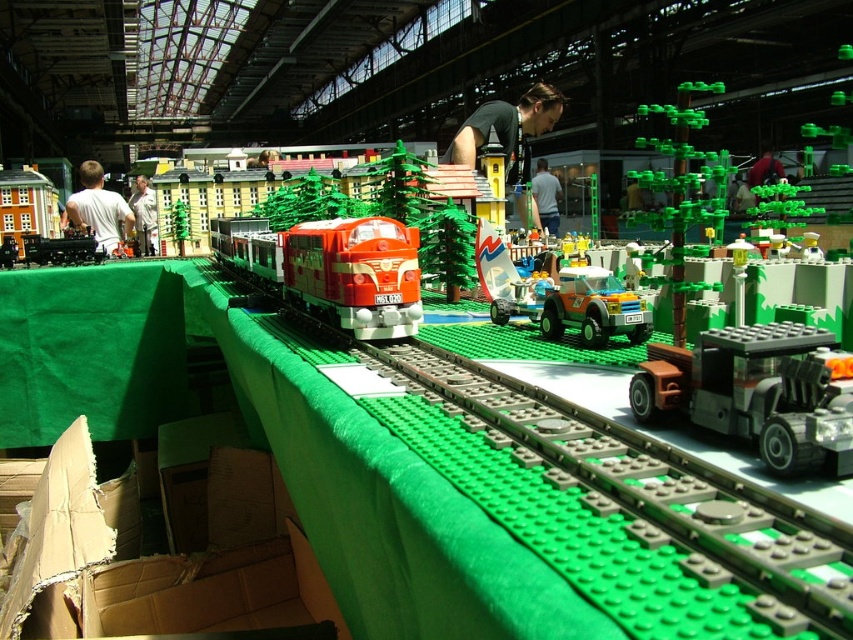
Question: Which of these objects is positioned farthest from the translucent orange plastic car at center?

Choices:
 (A) white shirt at left
 (B) white shirt at center
 (C) black shirt at upper center
 (D) matte black figure at center

Answer: (D)

Question: Is dark gray metallic truck at center right to the right of white t-shirt at left from the viewer's perspective?

Choices:
 (A) no
 (B) yes

Answer: (B)

Question: Which object is closer to the camera taking this photo?

Choices:
 (A) white shirt at left
 (B) white shirt at center
 (C) translucent orange plastic car at center

Answer: (C)

Question: Where is dark gray metallic truck at center right located in relation to translucent orange plastic car at center in the image?

Choices:
 (A) left
 (B) right

Answer: (B)

Question: Which object is farther from the camera taking this photo?

Choices:
 (A) matte black figure at center
 (B) black shirt at upper center
 (C) white shirt at left

Answer: (A)

Question: Is white t-shirt at left behind white shirt at center?

Choices:
 (A) no
 (B) yes

Answer: (A)